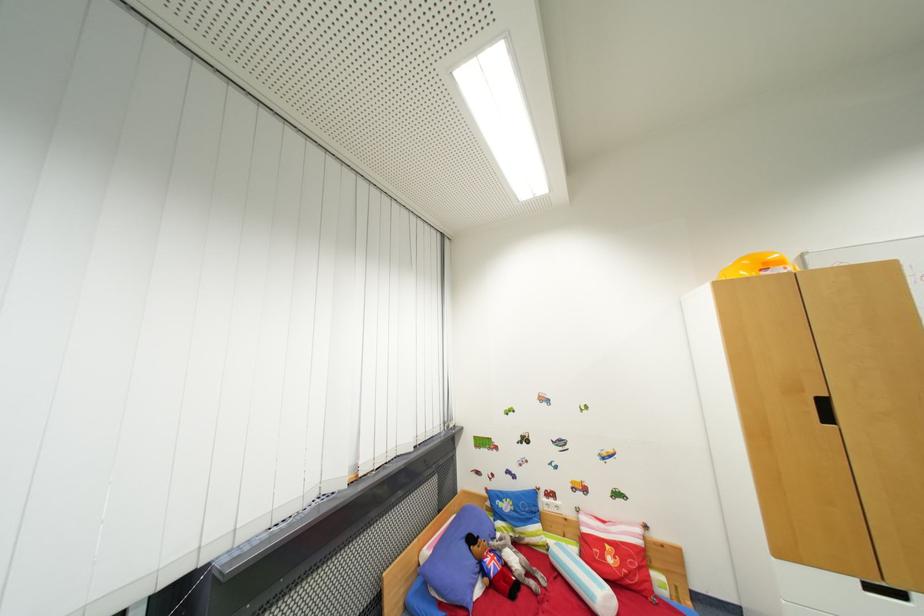
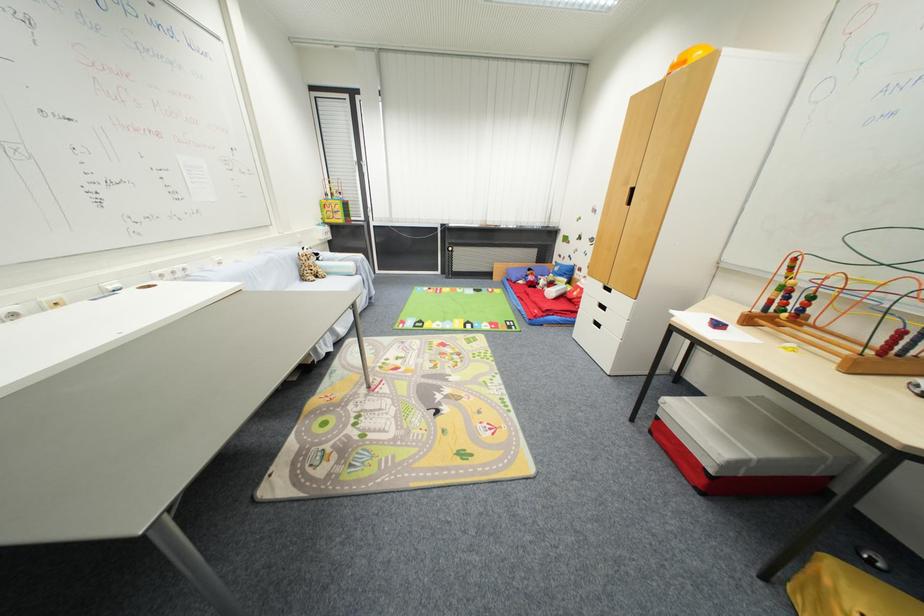
Where in the second image is the point corresponding to (x=864, y=584) from the first image?

(606, 286)